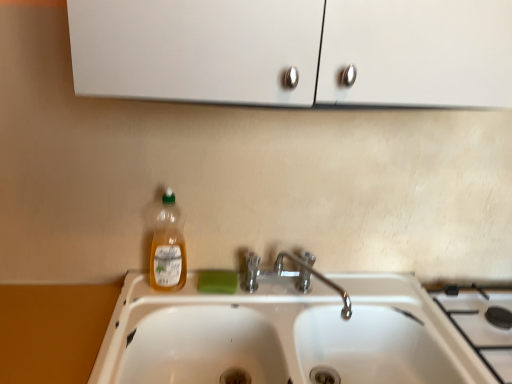
Question: From the image's perspective, is green matte soap at sink over translucent plastic bottle at center?

Choices:
 (A) yes
 (B) no

Answer: (B)

Question: Is translucent plastic bottle at center at the back of green matte soap at sink?

Choices:
 (A) no
 (B) yes

Answer: (A)

Question: Is translucent plastic bottle at center inside green matte soap at sink?

Choices:
 (A) no
 (B) yes

Answer: (A)

Question: From a real-world perspective, is green matte soap at sink positioned over translucent plastic bottle at center based on gravity?

Choices:
 (A) no
 (B) yes

Answer: (A)

Question: Does green matte soap at sink have a larger size compared to translucent plastic bottle at center?

Choices:
 (A) yes
 (B) no

Answer: (B)

Question: Does green matte soap at sink lie in front of translucent plastic bottle at center?

Choices:
 (A) no
 (B) yes

Answer: (A)

Question: Is white glossy sink at center not near white ceramic gas stove at lower right?

Choices:
 (A) yes
 (B) no

Answer: (B)

Question: Can we say white glossy sink at center lies outside white ceramic gas stove at lower right?

Choices:
 (A) yes
 (B) no

Answer: (A)

Question: Is white glossy sink at center facing away from white ceramic gas stove at lower right?

Choices:
 (A) no
 (B) yes

Answer: (A)

Question: From the image's perspective, is white glossy sink at center located above white ceramic gas stove at lower right?

Choices:
 (A) yes
 (B) no

Answer: (B)

Question: Is white glossy sink at center facing towards white ceramic gas stove at lower right?

Choices:
 (A) yes
 (B) no

Answer: (B)

Question: From a real-world perspective, is white glossy sink at center under white ceramic gas stove at lower right?

Choices:
 (A) yes
 (B) no

Answer: (A)

Question: Is green matte soap at sink oriented towards white glossy sink at center?

Choices:
 (A) no
 (B) yes

Answer: (A)